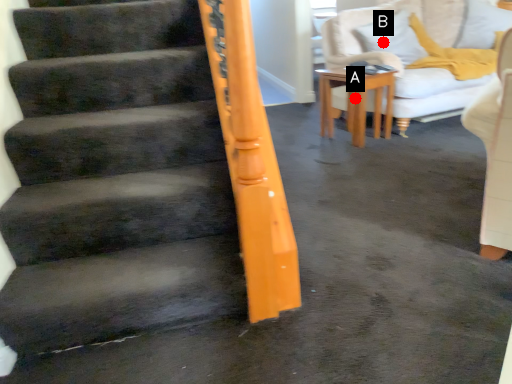
Question: Two points are circled on the image, labeled by A and B beside each circle. Which point appears closest to the camera in this image?

Choices:
 (A) A is closer
 (B) B is closer

Answer: (A)